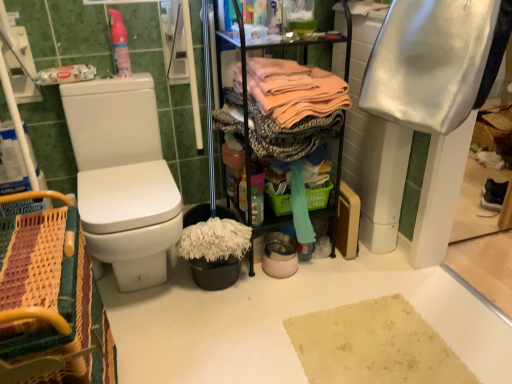
I want to click on free spot to the right of black plastic bucket at lower center, so click(x=275, y=289).